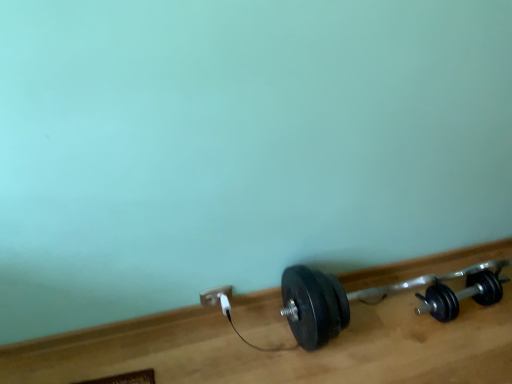
The height and width of the screenshot is (384, 512). What do you see at coordinates (375, 296) in the screenshot?
I see `black rubber dumbbell at lower right, which is counted as the 2th dumbbell, starting from the right` at bounding box center [375, 296].

Find the location of a particular element. The image size is (512, 384). white plastic power plug at lower center is located at coordinates (215, 295).

The image size is (512, 384). Identify the location of black rubber dumbbell at lower right, the first dumbbell viewed from the right. (461, 295).

Find the location of a particular element. The image size is (512, 384). the 2nd dumbbell in front of the white plastic power plug at lower center, counting from the anchor's position is located at coordinates (375, 296).

Between white plastic power plug at lower center and black rubber dumbbell at lower right, which is counted as the 2th dumbbell, starting from the right, which one has less height?

white plastic power plug at lower center is shorter.

Is white plastic power plug at lower center positioned with its back to black rubber dumbbell at lower right, which is counted as the 2th dumbbell, starting from the right?

No, black rubber dumbbell at lower right, which is counted as the 2th dumbbell, starting from the right, is not at the back of white plastic power plug at lower center.

Which is in front, point (222, 299) or point (230, 290)?

The point (222, 299) is closer to the camera.

In the scene shown: Which is behind, white plastic plug at lower center or white plastic power plug at lower center?

white plastic power plug at lower center is further from the camera.

In the scene shown: Does white plastic plug at lower center appear on the right side of white plastic power plug at lower center?

Indeed, white plastic plug at lower center is positioned on the right side of white plastic power plug at lower center.

Does white plastic plug at lower center have a lesser width compared to white plastic power plug at lower center?

No, white plastic plug at lower center is not thinner than white plastic power plug at lower center.

Looking at this image, is black rubber dumbbell at lower right, which is counted as the 2th dumbbell, starting from the right, aimed at white plastic power plug at lower center?

No, black rubber dumbbell at lower right, which is counted as the 2th dumbbell, starting from the right, does not turn towards white plastic power plug at lower center.

How different are the orientations of black rubber dumbbell at lower right, which appears as the 1th dumbbell when viewed from the left, and white plastic power plug at lower center in degrees?

0.000765 degrees.

Who is shorter, black rubber dumbbell at lower right, which appears as the 1th dumbbell when viewed from the left, or white plastic power plug at lower center?

white plastic power plug at lower center is shorter.

Considering the relative positions of black rubber dumbbell at lower right, which is counted as the 2th dumbbell, starting from the right, and black rubber dumbbell at lower right, the first dumbbell viewed from the right, in the image provided, is black rubber dumbbell at lower right, which is counted as the 2th dumbbell, starting from the right, to the left or to the right of black rubber dumbbell at lower right, the first dumbbell viewed from the right,?

Clearly, black rubber dumbbell at lower right, which is counted as the 2th dumbbell, starting from the right, is on the left of black rubber dumbbell at lower right, the first dumbbell viewed from the right, in the image.

Could black rubber dumbbell at lower right, the first dumbbell viewed from the right, be considered to be inside black rubber dumbbell at lower right, which appears as the 1th dumbbell when viewed from the left?

Yes, black rubber dumbbell at lower right, which appears as the 1th dumbbell when viewed from the left, is surrounding black rubber dumbbell at lower right, the first dumbbell viewed from the right.

Are black rubber dumbbell at lower right, which is counted as the 2th dumbbell, starting from the right, and black rubber dumbbell at lower right, the 2th dumbbell positioned from the left, far apart?

No, there isn't a large distance between black rubber dumbbell at lower right, which is counted as the 2th dumbbell, starting from the right, and black rubber dumbbell at lower right, the 2th dumbbell positioned from the left.

From the image's perspective, which one is positioned higher, black rubber dumbbell at lower right, which is counted as the 2th dumbbell, starting from the right, or black rubber dumbbell at lower right, the first dumbbell viewed from the right?

black rubber dumbbell at lower right, which is counted as the 2th dumbbell, starting from the right, from the image's perspective.

Would you say white plastic plug at lower center is a long distance from black rubber dumbbell at lower right, which appears as the 1th dumbbell when viewed from the left?

No.

In terms of size, does white plastic plug at lower center appear bigger or smaller than black rubber dumbbell at lower right, which is counted as the 2th dumbbell, starting from the right?

white plastic plug at lower center is smaller than black rubber dumbbell at lower right, which is counted as the 2th dumbbell, starting from the right.

Is white plastic plug at lower center located outside black rubber dumbbell at lower right, which is counted as the 2th dumbbell, starting from the right?

That's correct, white plastic plug at lower center is outside of black rubber dumbbell at lower right, which is counted as the 2th dumbbell, starting from the right.

Which object is positioned more to the right, white plastic plug at lower center or black rubber dumbbell at lower right, which is counted as the 2th dumbbell, starting from the right?

black rubber dumbbell at lower right, which is counted as the 2th dumbbell, starting from the right, is more to the right.

Which of these two, white plastic plug at lower center or black rubber dumbbell at lower right, the first dumbbell viewed from the right, is smaller?

white plastic plug at lower center is smaller.

Find the location of a particular element. The width and height of the screenshot is (512, 384). plug behind the black rubber dumbbell at lower right, the first dumbbell viewed from the right is located at coordinates (224, 304).

Which is behind, white plastic plug at lower center or black rubber dumbbell at lower right, the first dumbbell viewed from the right?

white plastic plug at lower center is more distant.

From the image's perspective, is white plastic plug at lower center above or below black rubber dumbbell at lower right, the first dumbbell viewed from the right?

Clearly, from the image's perspective, white plastic plug at lower center is below black rubber dumbbell at lower right, the first dumbbell viewed from the right.

Is white plastic power plug at lower center positioned before black rubber dumbbell at lower right, the first dumbbell viewed from the right?

No, it is not.

Is white plastic power plug at lower center turned away from black rubber dumbbell at lower right, the first dumbbell viewed from the right?

white plastic power plug at lower center is not turned away from black rubber dumbbell at lower right, the first dumbbell viewed from the right.

Are white plastic power plug at lower center and black rubber dumbbell at lower right, the first dumbbell viewed from the right, making contact?

There is a gap between white plastic power plug at lower center and black rubber dumbbell at lower right, the first dumbbell viewed from the right.

Considering the positions of points (207, 303) and (441, 284), is point (207, 303) closer to camera compared to point (441, 284)?

Yes, point (207, 303) is in front of point (441, 284).

Which dumbbell is the 2nd one when counting from the front of the white plastic power plug at lower center? Please provide its 2D coordinates.

[(375, 296)]

The height and width of the screenshot is (384, 512). I want to click on plug located below the white plastic power plug at lower center (from the image's perspective), so click(224, 304).

From the image, which object appears to be farther from white plastic power plug at lower center, white plastic plug at lower center or black rubber dumbbell at lower right, which appears as the 1th dumbbell when viewed from the left?

Based on the image, black rubber dumbbell at lower right, which appears as the 1th dumbbell when viewed from the left, appears to be further to white plastic power plug at lower center.

Looking at the image, which one is located closer to white plastic plug at lower center, black rubber dumbbell at lower right, the 2th dumbbell positioned from the left, or white plastic power plug at lower center?

Based on the image, white plastic power plug at lower center appears to be nearer to white plastic plug at lower center.

When comparing their distances from black rubber dumbbell at lower right, which is counted as the 2th dumbbell, starting from the right, does white plastic plug at lower center or black rubber dumbbell at lower right, the first dumbbell viewed from the right, seem further?

white plastic plug at lower center is further to black rubber dumbbell at lower right, which is counted as the 2th dumbbell, starting from the right.

Looking at the image, which one is located closer to black rubber dumbbell at lower right, the first dumbbell viewed from the right, black rubber dumbbell at lower right, which appears as the 1th dumbbell when viewed from the left, or white plastic power plug at lower center?

Based on the image, black rubber dumbbell at lower right, which appears as the 1th dumbbell when viewed from the left, appears to be nearer to black rubber dumbbell at lower right, the first dumbbell viewed from the right.

Looking at the image, which one is located further to black rubber dumbbell at lower right, the 2th dumbbell positioned from the left, white plastic power plug at lower center or white plastic plug at lower center?

The object further to black rubber dumbbell at lower right, the 2th dumbbell positioned from the left, is white plastic plug at lower center.

Estimate the real-world distances between objects in this image. Which object is further from black rubber dumbbell at lower right, the first dumbbell viewed from the right, black rubber dumbbell at lower right, which appears as the 1th dumbbell when viewed from the left, or white plastic plug at lower center?

The object further to black rubber dumbbell at lower right, the first dumbbell viewed from the right, is white plastic plug at lower center.

Looking at the image, which one is located closer to white plastic power plug at lower center, white plastic plug at lower center or black rubber dumbbell at lower right, the 2th dumbbell positioned from the left?

Based on the image, white plastic plug at lower center appears to be nearer to white plastic power plug at lower center.

Which object lies nearer to the anchor point black rubber dumbbell at lower right, which is counted as the 2th dumbbell, starting from the right, black rubber dumbbell at lower right, the first dumbbell viewed from the right, or white plastic plug at lower center?

The object closer to black rubber dumbbell at lower right, which is counted as the 2th dumbbell, starting from the right, is black rubber dumbbell at lower right, the first dumbbell viewed from the right.

Find the location of `dumbbell situated between white plastic power plug at lower center and black rubber dumbbell at lower right, the first dumbbell viewed from the right, from left to right`. dumbbell situated between white plastic power plug at lower center and black rubber dumbbell at lower right, the first dumbbell viewed from the right, from left to right is located at coordinates [x=375, y=296].

At what (x,y) coordinates should I click in order to perform the action: click on plug between white plastic power plug at lower center and black rubber dumbbell at lower right, the 2th dumbbell positioned from the left. Please return your answer as a coordinate pair (x, y). This screenshot has height=384, width=512. Looking at the image, I should click on (224, 304).

Find the location of a particular element. Image resolution: width=512 pixels, height=384 pixels. dumbbell situated between white plastic plug at lower center and black rubber dumbbell at lower right, the first dumbbell viewed from the right, from left to right is located at coordinates (375, 296).

Where is `plug between white plastic power plug at lower center and black rubber dumbbell at lower right, which is counted as the 2th dumbbell, starting from the right`? The width and height of the screenshot is (512, 384). plug between white plastic power plug at lower center and black rubber dumbbell at lower right, which is counted as the 2th dumbbell, starting from the right is located at coordinates (224, 304).